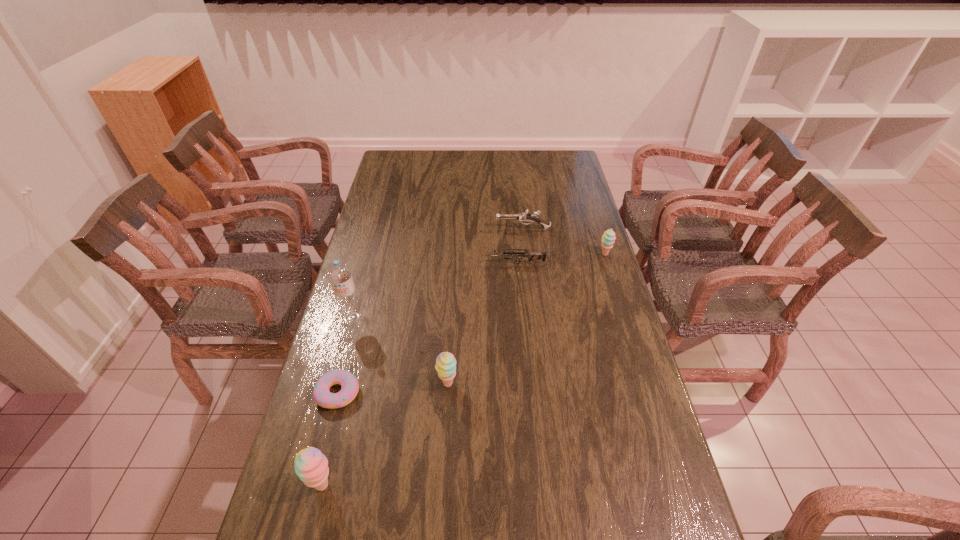
Find the location of a particular element. Image resolution: width=960 pixels, height=540 pixels. vacant region located 0.390m aimed along the barrel of the farthest object is located at coordinates coord(397,229).

Image resolution: width=960 pixels, height=540 pixels. Identify the location of free spot located aimed along the barrel of the farthest object. (456, 229).

Locate an element on the screen. This screenshot has height=540, width=960. blank area located 0.110m on the front of the tallest object is located at coordinates (343, 354).

Where is `blank area located 0.110m on the right of the doughnut`? The image size is (960, 540). blank area located 0.110m on the right of the doughnut is located at coordinates (399, 393).

Where is `object present at the near edge`? object present at the near edge is located at coordinates (311, 465).

Find the location of `sherbert present at the left edge`. sherbert present at the left edge is located at coordinates (311, 465).

You are a GUI agent. You are given a task and a screenshot of the screen. Output one action in this format:
    pyautogui.click(x=<x>, y=<y>)
    Task: Click on the water bottle situated at the left edge
    This screenshot has width=960, height=540.
    Given the screenshot: What is the action you would take?
    pyautogui.click(x=339, y=274)

Where is `doughnut that is at the left edge`? The height and width of the screenshot is (540, 960). doughnut that is at the left edge is located at coordinates (322, 396).

The width and height of the screenshot is (960, 540). Identify the location of object that is positioned at the right edge. (608, 237).

Find the location of `object that is at the near left corner`. object that is at the near left corner is located at coordinates (311, 465).